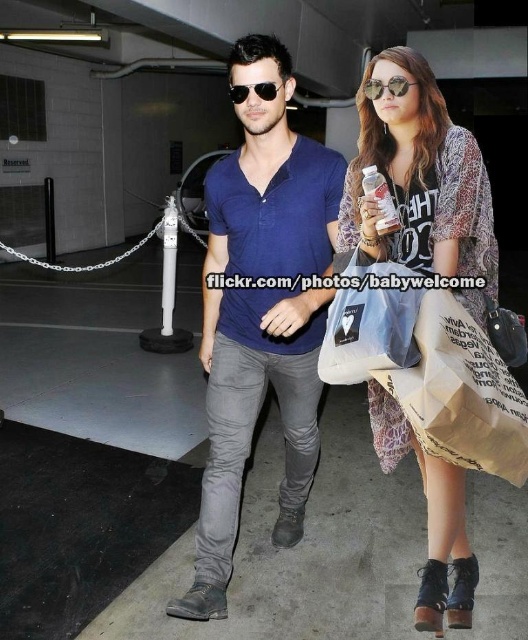
Based on the photo, you are a security camera monitoring the parking garage. You need to determine if the light blue fabric shopping bag at center can be placed inside the brown suede boot at lower right based on their sizes. What is your conclusion?

The light blue fabric shopping bag at center is much taller than the brown suede boot at lower right, so it cannot fit inside the boot.

You are a delivery person trying to deliver a package to the woman holding the light blue fabric shopping bag at center. The package is too large for her to carry in her hands. Can she place the package on top of the brown suede boot at lower right?

The light blue fabric shopping bag at center is larger than the brown suede boot at lower right. Since the package is too large for her to carry in her hands, placing it on top of the brown suede boot at lower right may not be feasible due to the boot being smaller in size compared to the shopping bag.